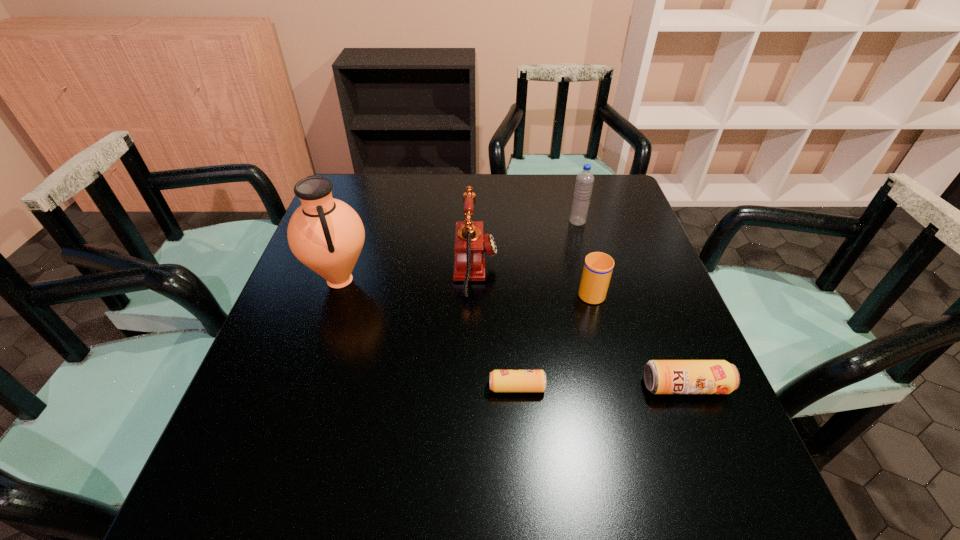
Image resolution: width=960 pixels, height=540 pixels. In order to click on unoccupied position between the water bottle and the left beer can in this screenshot , I will do `click(547, 305)`.

This screenshot has width=960, height=540. I want to click on empty space that is in between the tallest object and the taller beer can, so click(513, 333).

You are a GUI agent. You are given a task and a screenshot of the screen. Output one action in this format:
    pyautogui.click(x=<x>, y=<y>)
    Task: Click on the empty space between the cup and the taller beer can
    
    Given the screenshot: What is the action you would take?
    pyautogui.click(x=638, y=339)

Locate an element on the screen. The width and height of the screenshot is (960, 540). empty space between the left beer can and the third shortest object is located at coordinates tap(554, 339).

Image resolution: width=960 pixels, height=540 pixels. I want to click on vacant space that is in between the left beer can and the third shortest object, so click(x=554, y=339).

Where is `free spot between the right beer can and the water bottle`? The width and height of the screenshot is (960, 540). free spot between the right beer can and the water bottle is located at coordinates (632, 304).

You are a GUI agent. You are given a task and a screenshot of the screen. Output one action in this format:
    pyautogui.click(x=<x>, y=<y>)
    Task: Click on the fifth closest object to the shortest object
    This screenshot has width=960, height=540.
    Given the screenshot: What is the action you would take?
    pyautogui.click(x=584, y=182)

Where is `object identified as the fifth closest to the fourth tallest object`? This screenshot has height=540, width=960. object identified as the fifth closest to the fourth tallest object is located at coordinates (327, 235).

This screenshot has height=540, width=960. In order to click on vacant region that satisfies the following two spatial constraints: 1. on the dial of the shorter beer can; 2. on the right side of the telephone in this screenshot , I will do `click(474, 387)`.

The height and width of the screenshot is (540, 960). Identify the location of free space that satisfies the following two spatial constraints: 1. on the front side of the pitcher; 2. on the right side of the rightmost object. (304, 387).